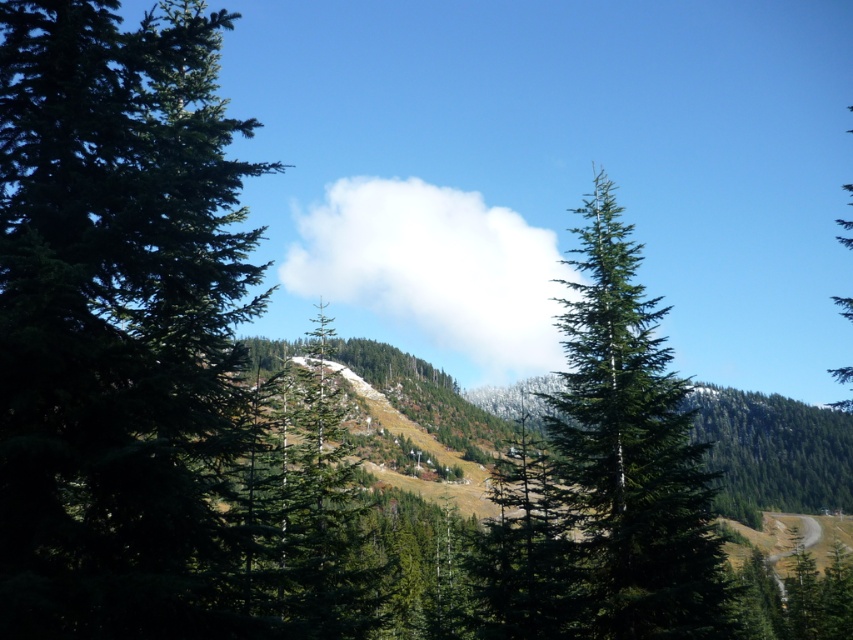
You are standing at the point marked by the coordinates point (607, 476) in a mountain landscape. What object are you likely standing next to?

You are likely standing next to the green matte tree at center, as the coordinates point (607, 476) represent its location.

You are standing at the point with coordinates point (483, 282) and want to move towards the mountains in the background. There is another point at point (563, 429). Can you walk directly towards the mountains without passing through the other point?

Point (563, 429) is in front of point (483, 282). Therefore, you would have to pass through point (563, 429) before reaching the mountains, so you cannot walk directly towards the mountains without passing through the other point.

You are an artist planning to paint this mountain scene. You want to ensure that the white fluffy cloud at center and the green matte tree at right are proportionally accurate. Based on the scene description, which object should you make smaller in your painting?

The white fluffy cloud at center should be made smaller in the painting because it occupies less space than the green matte tree at right according to the description.